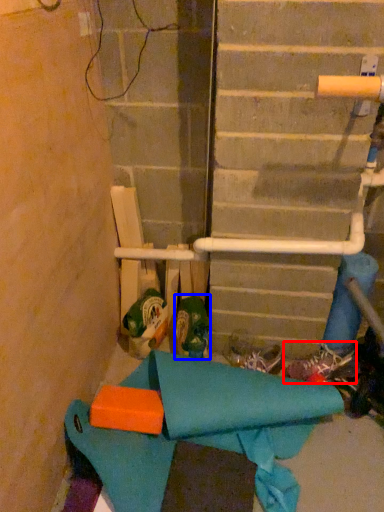
Question: Which point is closer to the camera, footwear (highlighted by a red box) or footwear (highlighted by a blue box)?

Choices:
 (A) footwear
 (B) footwear

Answer: (B)